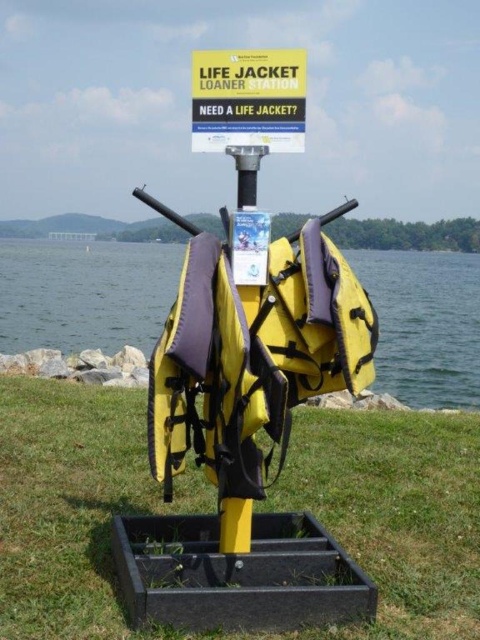
Is yellow fabric life jackets at center positioned before metallic pole at center?

Yes, yellow fabric life jackets at center is in front of metallic pole at center.

In the scene shown: Between yellow fabric life jackets at center and metallic pole at center, which one has less height?

With less height is metallic pole at center.

Who is more distant from viewer, (107, 349) or (218, 541)?

The point (107, 349) is more distant.

Identify the location of yellow fabric life jackets at center. The height and width of the screenshot is (640, 480). (84, 292).

Is point (231, 58) closer to camera compared to point (226, 541)?

Yes, it is.

Between yellow paper sign at upper center and metallic pole at center, which one has more height?

Standing taller between the two is yellow paper sign at upper center.

Is point (204, 100) closer to viewer compared to point (230, 509)?

Yes.

The width and height of the screenshot is (480, 640). What are the coordinates of `yellow paper sign at upper center` in the screenshot? It's located at (249, 99).

Which of these two, yellow fabric life jacket at center or metallic pole at center, stands taller?

Standing taller between the two is yellow fabric life jacket at center.

Is yellow fabric life jacket at center shorter than metallic pole at center?

Incorrect, yellow fabric life jacket at center's height does not fall short of metallic pole at center's.

Who is more distant from viewer, (243,385) or (252,189)?

The point (252,189) is more distant.

Find the location of a particular element. This screenshot has height=640, width=480. yellow fabric life jacket at center is located at coordinates click(x=252, y=356).